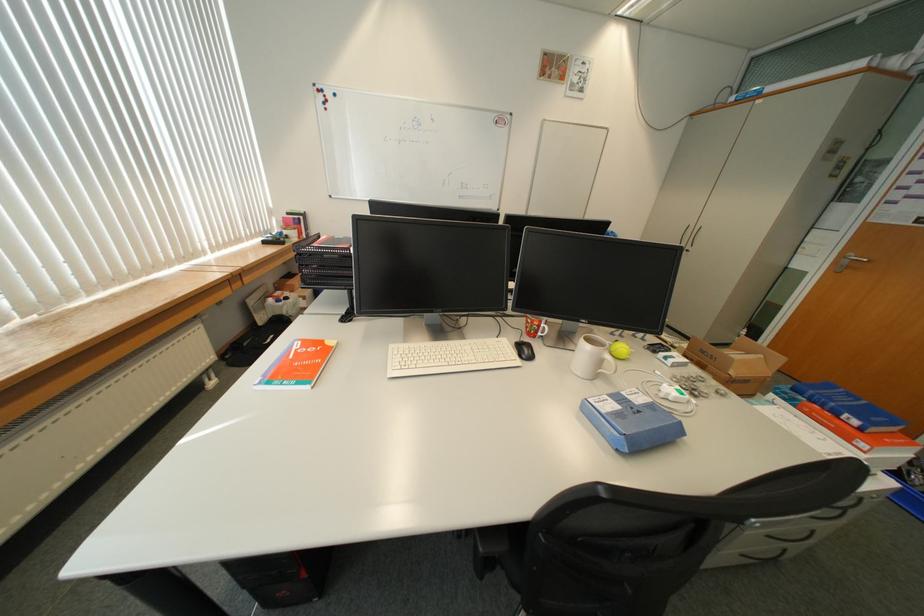
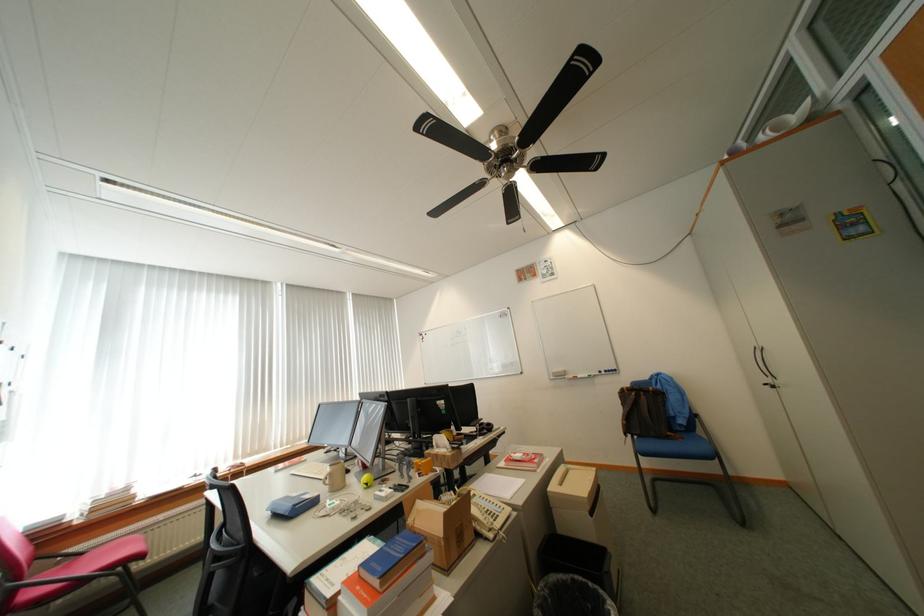
Find the pixel in the second image that matches pixel 882 419 in the first image.

(383, 565)